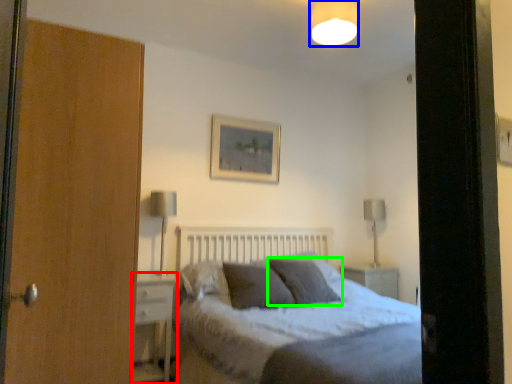
Question: Which is farther away from nightstand (highlighted by a red box)? light fixture (highlighted by a blue box) or pillow (highlighted by a green box)?

Choices:
 (A) light fixture
 (B) pillow

Answer: (A)